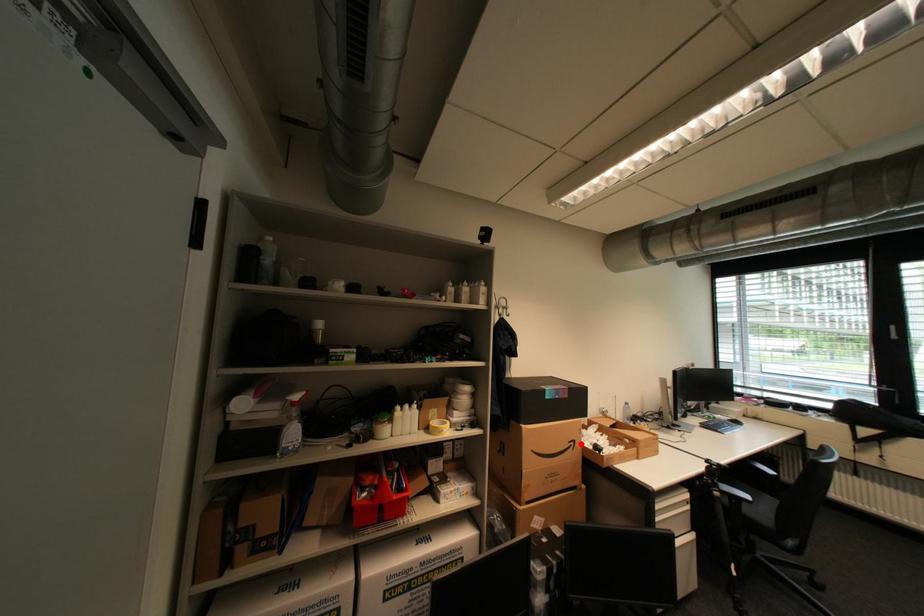
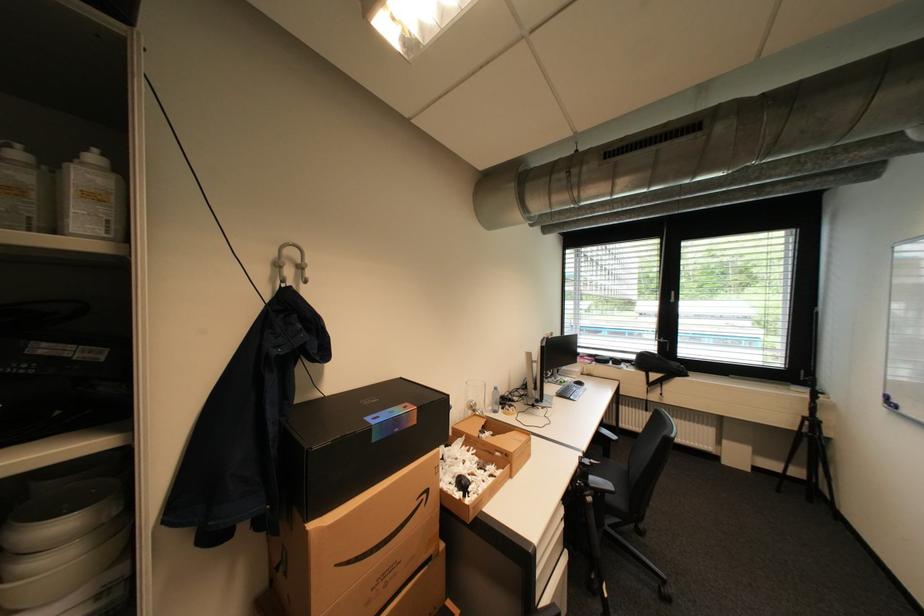
Locate, in the second image, the point that corresponds to the highlighted location in the first image.

(433, 496)